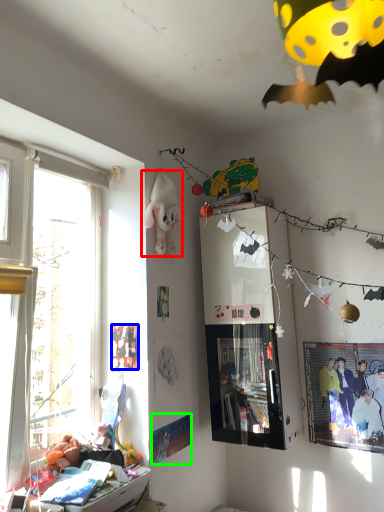
Question: Based on their relative distances, which object is farther from toy (highlighted by a red box)? Choose from poster page (highlighted by a blue box) and poster page (highlighted by a green box).

Choices:
 (A) poster page
 (B) poster page

Answer: (B)